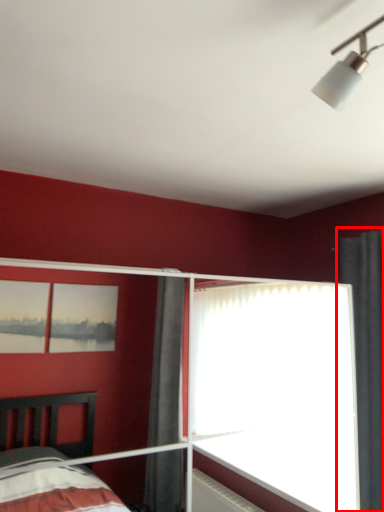
Question: Observing the image, what is the correct spatial positioning of curtain (annotated by the red box) in reference to glass door?

Choices:
 (A) left
 (B) right

Answer: (B)